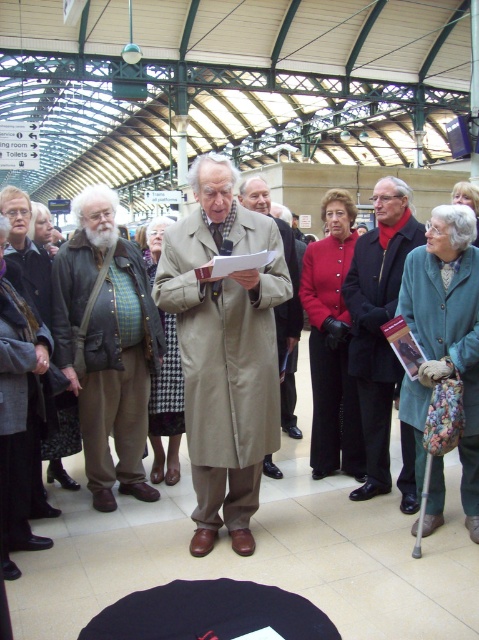
Based on the scene description, which object, the tan fabric coat at center or the brown leather jacket at left, is taller?

The tan fabric coat at center is taller than the brown leather jacket at left.